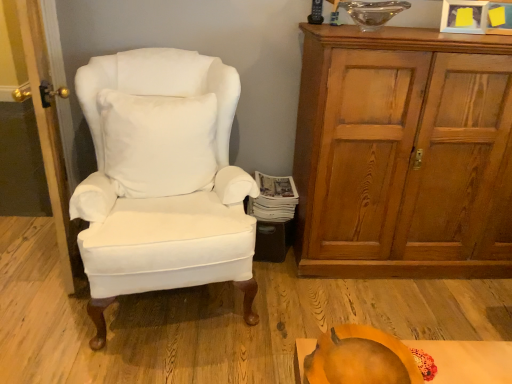
Question: From the image's perspective, relative to orange matte pumpkin at lower center, is wooden door at left above or below?

Choices:
 (A) below
 (B) above

Answer: (B)

Question: Considering the positions of wooden door at left and orange matte pumpkin at lower center in the image, is wooden door at left taller or shorter than orange matte pumpkin at lower center?

Choices:
 (A) tall
 (B) short

Answer: (A)

Question: Which of these objects is positioned closest to the orange matte pumpkin at lower center?

Choices:
 (A) wooden door at left
 (B) white cotton wingback chair at left
 (C) wooden cabinet at right
 (D) white soft pillow at center

Answer: (B)

Question: Considering the real-world distances, which object is closest to the orange matte pumpkin at lower center?

Choices:
 (A) white soft pillow at center
 (B) wooden cabinet at right
 (C) white cotton wingback chair at left
 (D) wooden door at left

Answer: (C)